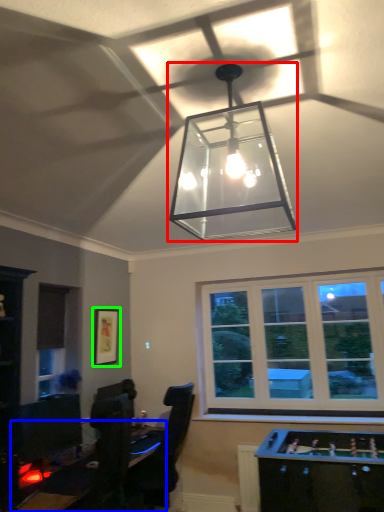
Question: Which object is positioned farthest from lamp (highlighted by a red box)? Select from table (highlighted by a blue box) and picture frame (highlighted by a green box).

Choices:
 (A) table
 (B) picture frame

Answer: (B)